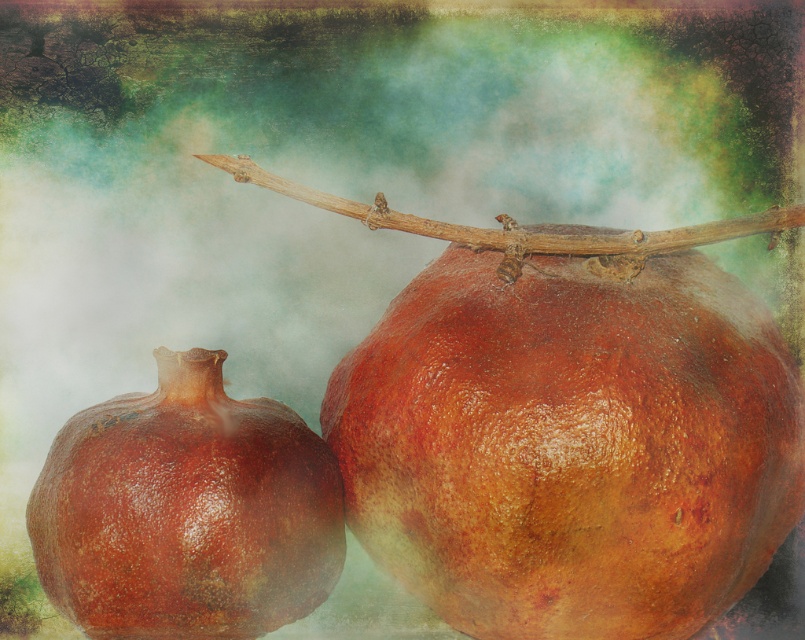
Describe the element at coordinates (186, 512) in the screenshot. This screenshot has height=640, width=805. I see `shiny brown pomegranate at center` at that location.

Can you confirm if shiny brown pomegranate at center is positioned to the right of brown rough branch at center?

In fact, shiny brown pomegranate at center is to the left of brown rough branch at center.

This screenshot has height=640, width=805. Identify the location of shiny brown pomegranate at center. (186, 512).

Is glossy brown pomegranate at center smaller than shiny brown pomegranate at center?

Incorrect, glossy brown pomegranate at center is not smaller in size than shiny brown pomegranate at center.

Who is lower down, glossy brown pomegranate at center or shiny brown pomegranate at center?

shiny brown pomegranate at center is below.

Identify the location of glossy brown pomegranate at center. Image resolution: width=805 pixels, height=640 pixels. (570, 444).

At what (x,y) coordinates should I click in order to perform the action: click on glossy brown pomegranate at center. Please return your answer as a coordinate pair (x, y). The width and height of the screenshot is (805, 640). Looking at the image, I should click on (570, 444).

Is point (638, 364) closer to camera compared to point (485, 240)?

Yes, it is.

Identify the location of glossy brown pomegranate at center. This screenshot has width=805, height=640. (570, 444).